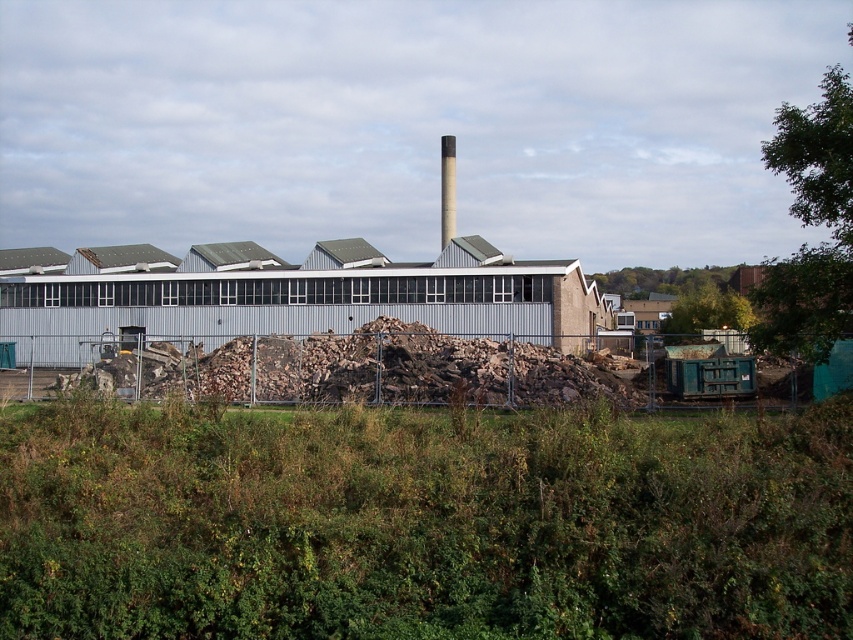
You are standing at the entrance of the industrial building and notice a specific point marked at coordinates (358, 369). What object is located at this point?

The point at coordinates (358, 369) corresponds to the brown rough wood at center.

You are standing at a safe distance from the metallic gray building at center. A safety regulation states that you must stay at least 30 meters away from any industrial building. Are you compliant with this regulation?

The metallic gray building at center is 29.12 meters away from you, which is less than the required 30 meters. Therefore, you are not compliant with the safety regulation.

You are a delivery truck driver who needs to back up your 30 feet long truck into the industrial area shown. The truck must pass between the metallic gray building at center and the brown rough wood at center. Can your truck fit through the space between them?

The distance between the metallic gray building at center and the brown rough wood at center is 36.27 feet. Since the truck is 30 feet long, it can fit through the space as the available width is greater than the truck length.